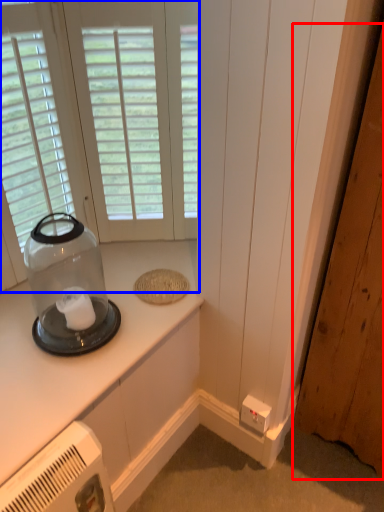
Question: Which of the following is the closest to the observer, door (highlighted by a red box) or window (highlighted by a blue box)?

Choices:
 (A) door
 (B) window

Answer: (A)